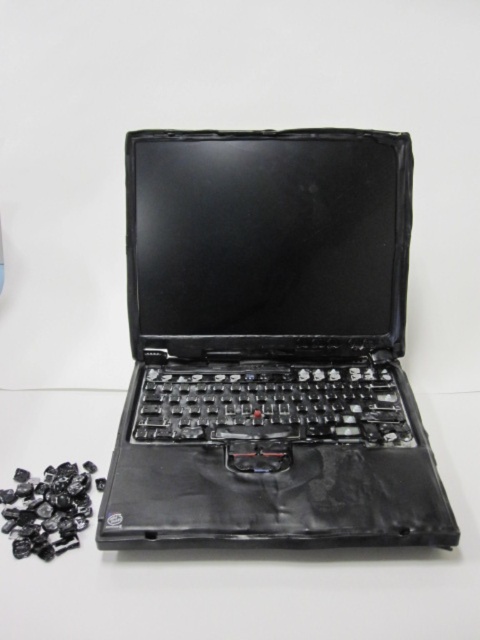
Question: Which object is farther from the camera taking this photo?

Choices:
 (A) matte black laptop at center
 (B) black plastic keyboard at lower center

Answer: (A)

Question: Does matte black laptop at center have a larger size compared to black plastic keyboard at lower center?

Choices:
 (A) yes
 (B) no

Answer: (B)

Question: Can you confirm if matte black laptop at center is wider than black plastic keyboard at lower center?

Choices:
 (A) yes
 (B) no

Answer: (B)

Question: Observing the image, what is the correct spatial positioning of matte black laptop at center in reference to black plastic keyboard at lower center?

Choices:
 (A) right
 (B) left

Answer: (A)